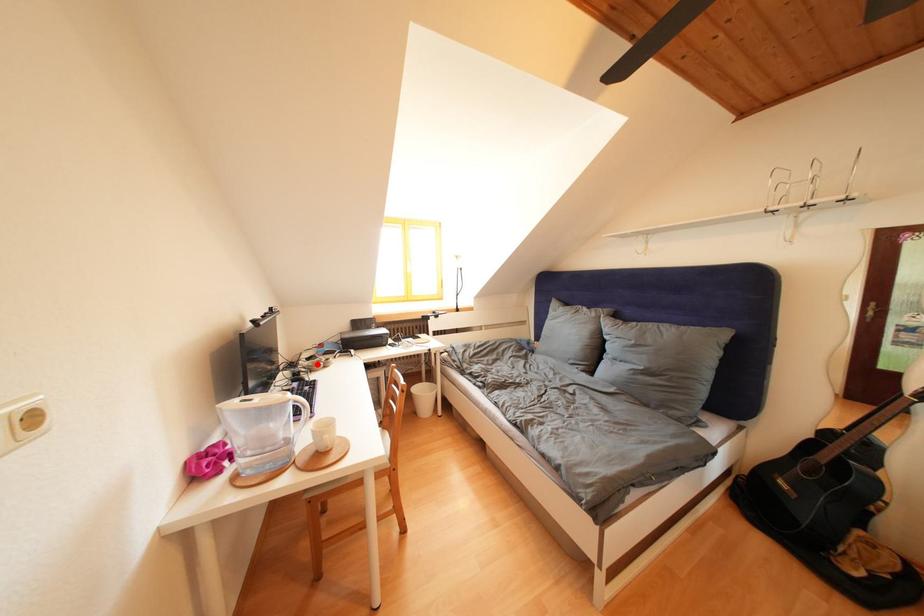
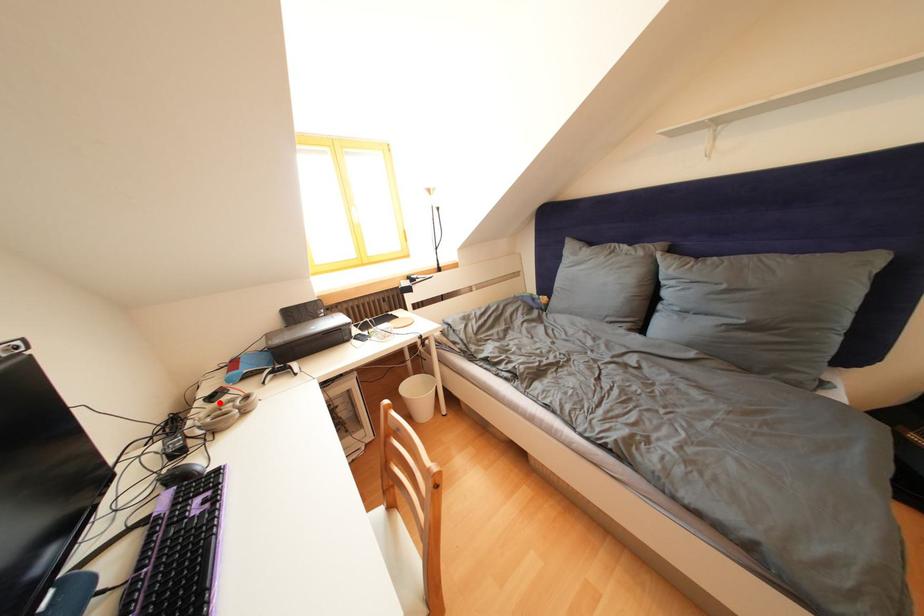
I am providing you with two images of the same scene from different viewpoints. A red point is marked on the first image and another point is marked on the second image. Is the red point in image1 aligned with the point shown in image2?

Yes